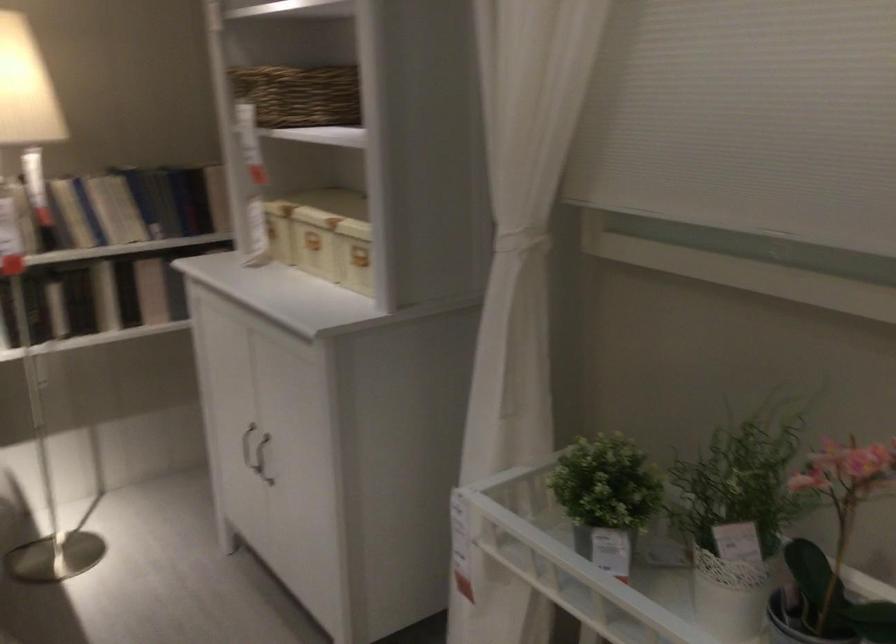
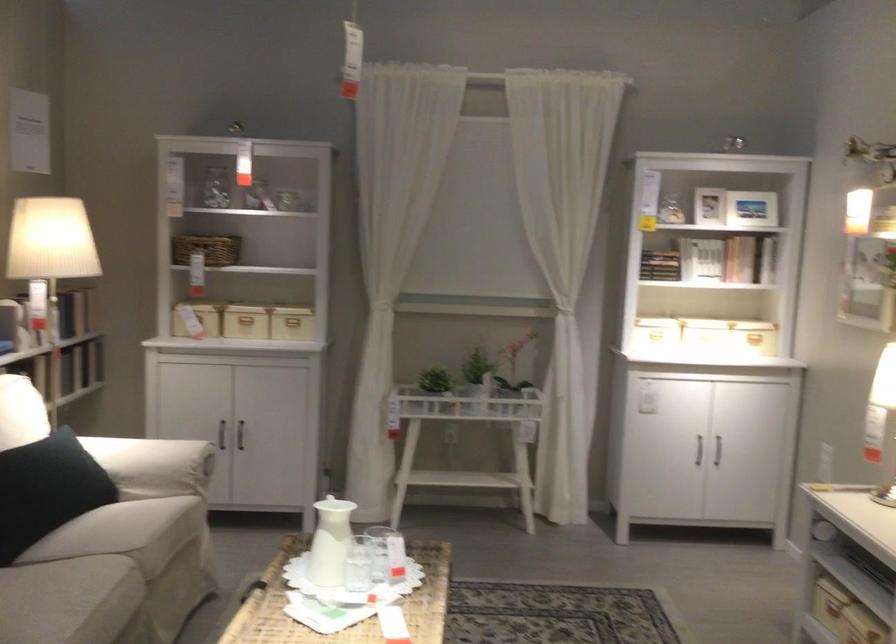
Find the pixel in the second image that matches (x=245, y=444) in the first image.

(221, 433)